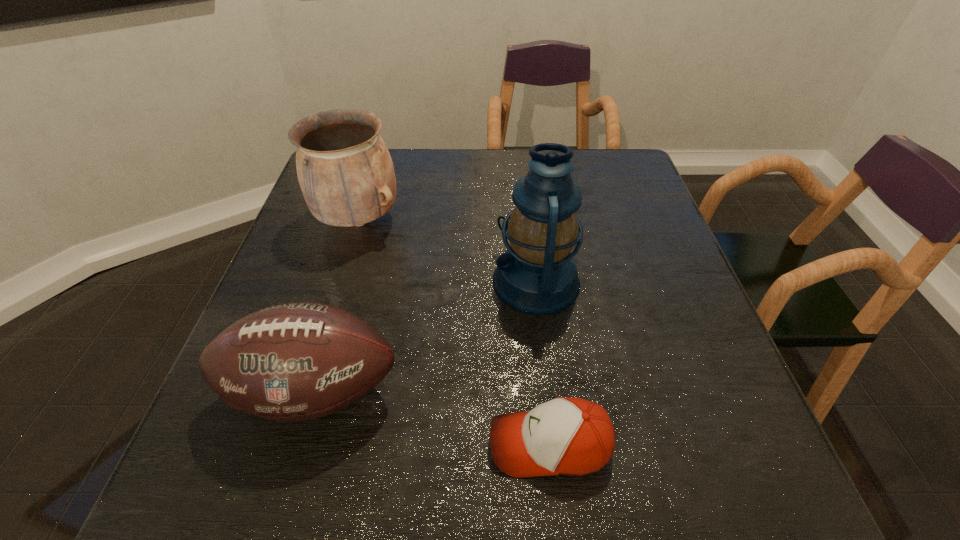
Locate which object is the second closest to the baseball cap. Please provide its 2D coordinates. Your answer should be formatted as a tuple, i.e. [(x, y)], where the tuple contains the x and y coordinates of a point satisfying the conditions above.

[(537, 275)]

Where is `object identified as the third closest to the tallest object`? The width and height of the screenshot is (960, 540). object identified as the third closest to the tallest object is located at coordinates (345, 171).